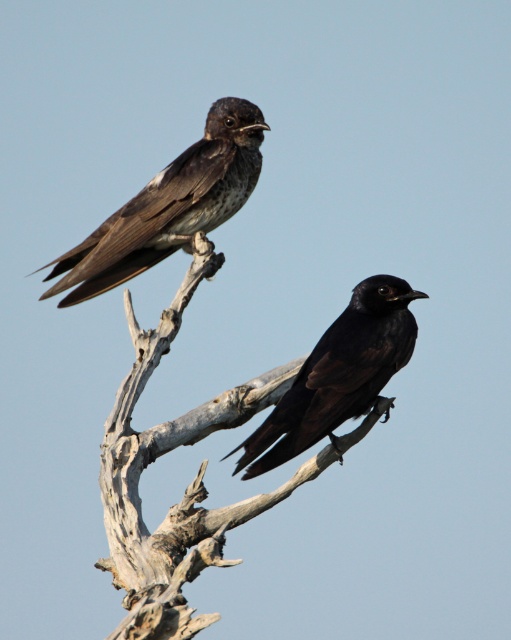
Question: Does brown wood branch at upper center have a greater width compared to shiny black bird at upper left?

Choices:
 (A) yes
 (B) no

Answer: (A)

Question: Which object is closer to the camera taking this photo?

Choices:
 (A) shiny black bird at upper left
 (B) shiny black bird at center
 (C) brown wood branch at upper center

Answer: (B)

Question: Which point is closer to the camera?

Choices:
 (A) (416, 292)
 (B) (244, 125)

Answer: (A)

Question: Considering the real-world distances, which object is farthest from the shiny black bird at upper left?

Choices:
 (A) shiny black bird at center
 (B) brown wood branch at upper center

Answer: (A)

Question: Can you confirm if brown wood branch at upper center is positioned above shiny black bird at upper left?

Choices:
 (A) yes
 (B) no

Answer: (B)

Question: Does brown wood branch at upper center appear on the left side of shiny black bird at upper left?

Choices:
 (A) no
 (B) yes

Answer: (A)